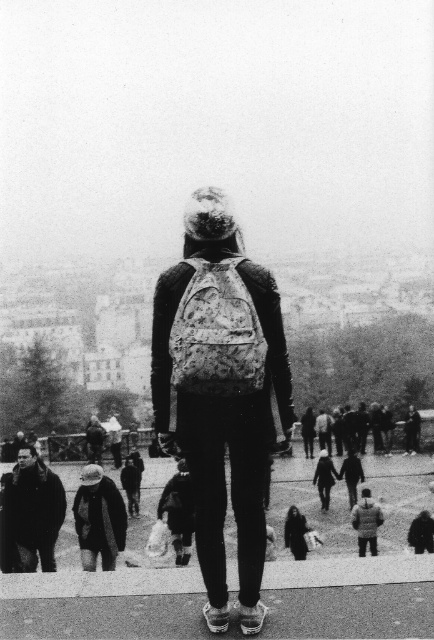
Who is lower down, floral-patterned backpack at center or dark gray woolen hat at lower left?

dark gray woolen hat at lower left is below.

At what (x,y) coordinates should I click in order to perform the action: click on floral-patterned backpack at center. Please return your answer as a coordinate pair (x, y). This screenshot has width=434, height=640. Looking at the image, I should click on (220, 392).

At what (x,y) coordinates should I click in order to perform the action: click on floral-patterned backpack at center. Please return your answer as a coordinate pair (x, y). The width and height of the screenshot is (434, 640). Looking at the image, I should click on (220, 392).

Who is lower down, dark brown leather jacket at lower left or dark gray woolen hat at lower left?

Positioned lower is dark brown leather jacket at lower left.

Between dark brown leather jacket at lower left and dark gray woolen hat at lower left, which one has less height?

Standing shorter between the two is dark gray woolen hat at lower left.

Find the location of `dark brown leather jacket at lower left`. dark brown leather jacket at lower left is located at coordinates (29, 515).

Where is `dark brown leather jacket at lower left`? dark brown leather jacket at lower left is located at coordinates (29, 515).

Who is positioned more to the left, dark brown leather jacket at lower left or dark gray wool coat at lower center?

dark brown leather jacket at lower left is more to the left.

Where is `dark brown leather jacket at lower left`? This screenshot has height=640, width=434. dark brown leather jacket at lower left is located at coordinates 29,515.

Is point (7, 545) more distant than point (292, 532)?

No, it is in front of (292, 532).

Image resolution: width=434 pixels, height=640 pixels. I want to click on dark brown leather jacket at lower left, so click(29, 515).